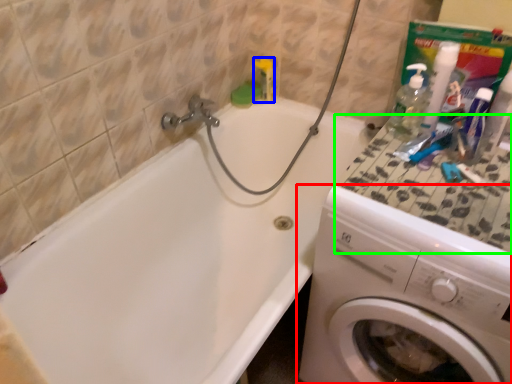
Question: Considering the real-world distances, which object is closest to washing machine (highlighted by a red box)? toiletry (highlighted by a blue box) or counter top (highlighted by a green box).

Choices:
 (A) toiletry
 (B) counter top

Answer: (B)